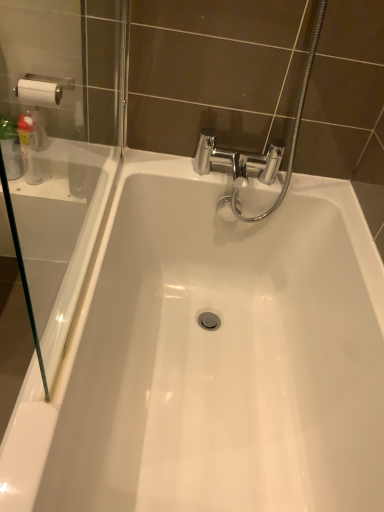
Question: Is transparent glass screen door at left turned away from translucent plastic bottle at left?

Choices:
 (A) yes
 (B) no

Answer: (B)

Question: Is transparent glass screen door at left bigger than translucent plastic bottle at left?

Choices:
 (A) no
 (B) yes

Answer: (B)

Question: Is transparent glass screen door at left further to the viewer compared to translucent plastic bottle at left?

Choices:
 (A) no
 (B) yes

Answer: (A)

Question: Is transparent glass screen door at left in contact with translucent plastic bottle at left?

Choices:
 (A) yes
 (B) no

Answer: (B)

Question: Does transparent glass screen door at left have a greater width compared to translucent plastic bottle at left?

Choices:
 (A) yes
 (B) no

Answer: (B)

Question: Considering the positions of translucent plastic bottle at left and transparent glass screen door at left in the image, is translucent plastic bottle at left taller or shorter than transparent glass screen door at left?

Choices:
 (A) tall
 (B) short

Answer: (B)

Question: From the image's perspective, is translucent plastic bottle at left positioned above or below transparent glass screen door at left?

Choices:
 (A) above
 (B) below

Answer: (A)

Question: Does point (29, 130) appear closer or farther from the camera than point (105, 41)?

Choices:
 (A) closer
 (B) farther

Answer: (B)

Question: In the image, is translucent plastic bottle at left on the left side or the right side of transparent glass screen door at left?

Choices:
 (A) left
 (B) right

Answer: (A)

Question: In the image, is translucent plastic bottle at left positioned in front of or behind white glossy bathtub at center?

Choices:
 (A) behind
 (B) front

Answer: (A)

Question: Based on their sizes in the image, would you say translucent plastic bottle at left is bigger or smaller than white glossy bathtub at center?

Choices:
 (A) big
 (B) small

Answer: (B)

Question: Considering the positions of translucent plastic bottle at left and white glossy bathtub at center in the image, is translucent plastic bottle at left wider or thinner than white glossy bathtub at center?

Choices:
 (A) wide
 (B) thin

Answer: (B)

Question: From a real-world perspective, is translucent plastic bottle at left above or below white glossy bathtub at center?

Choices:
 (A) above
 (B) below

Answer: (A)

Question: In terms of size, does transparent glass screen door at left appear bigger or smaller than translucent plastic bottle at left?

Choices:
 (A) big
 (B) small

Answer: (A)

Question: Is transparent glass screen door at left situated inside translucent plastic bottle at left or outside?

Choices:
 (A) outside
 (B) inside

Answer: (A)